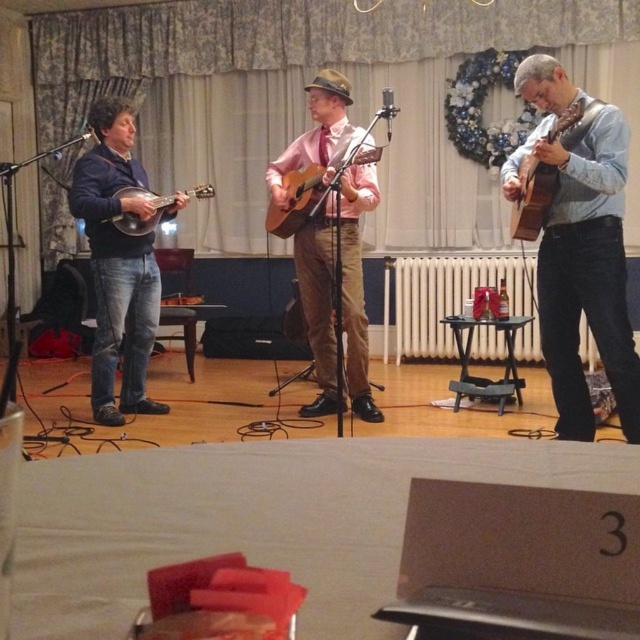
You are sitting in the audience and want to know which of the two points, point (566, 364) or point (368, 156), is closer to you. Based on the stage setup, can you determine which point is nearer?

Point (566, 364) is closer to the viewer than point (368, 156).

You are a photographer standing at the back of the venue, and you want to capture a closeup shot of the matte black mandolin at left. Considering your current position, do you think you can get a clear closeup without moving closer?

The matte black mandolin at left is 3.44 meters away from camera, so it is possible to capture a clear closeup shot from your current position using a zoom lens without needing to move closer.

Based on the scene description, where is the acoustic wood guitar at center located in relation to the banjo player and the third performer?

The acoustic wood guitar at center is located between the banjo player on the left and the third performer on the right.